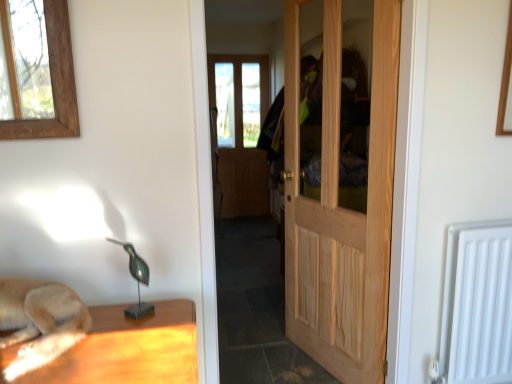
Question: From the image's perspective, is green metallic bird at center located above white matte radiator at lower right?

Choices:
 (A) no
 (B) yes

Answer: (B)

Question: Is green metallic bird at center closer to camera compared to white matte radiator at lower right?

Choices:
 (A) no
 (B) yes

Answer: (B)

Question: Can you confirm if green metallic bird at center is positioned to the left of white matte radiator at lower right?

Choices:
 (A) yes
 (B) no

Answer: (A)

Question: From the image's perspective, does green metallic bird at center appear lower than white matte radiator at lower right?

Choices:
 (A) yes
 (B) no

Answer: (B)

Question: Does green metallic bird at center appear on the right side of white matte radiator at lower right?

Choices:
 (A) yes
 (B) no

Answer: (B)

Question: Considering the positions of white matte radiator at lower right and green metallic bird at center in the image, is white matte radiator at lower right wider or thinner than green metallic bird at center?

Choices:
 (A) thin
 (B) wide

Answer: (B)

Question: Relative to green metallic bird at center, is white matte radiator at lower right in front or behind?

Choices:
 (A) front
 (B) behind

Answer: (B)

Question: From the image's perspective, is white matte radiator at lower right positioned above or below green metallic bird at center?

Choices:
 (A) below
 (B) above

Answer: (A)

Question: Is white matte radiator at lower right inside the boundaries of green metallic bird at center, or outside?

Choices:
 (A) outside
 (B) inside

Answer: (A)

Question: In the image, is green metallic bird at center positioned in front of or behind natural wood door at center?

Choices:
 (A) front
 (B) behind

Answer: (A)

Question: Is green metallic bird at center inside the boundaries of natural wood door at center, or outside?

Choices:
 (A) inside
 (B) outside

Answer: (B)

Question: Considering the positions of green metallic bird at center and natural wood door at center in the image, is green metallic bird at center wider or thinner than natural wood door at center?

Choices:
 (A) thin
 (B) wide

Answer: (A)

Question: From the image's perspective, is green metallic bird at center above or below natural wood door at center?

Choices:
 (A) below
 (B) above

Answer: (A)

Question: Relative to green metallic bird at center, is natural wood door at center in front or behind?

Choices:
 (A) behind
 (B) front

Answer: (A)

Question: In the image, is natural wood door at center on the left side or the right side of green metallic bird at center?

Choices:
 (A) right
 (B) left

Answer: (A)